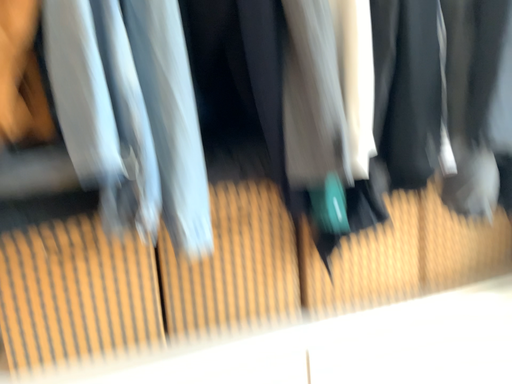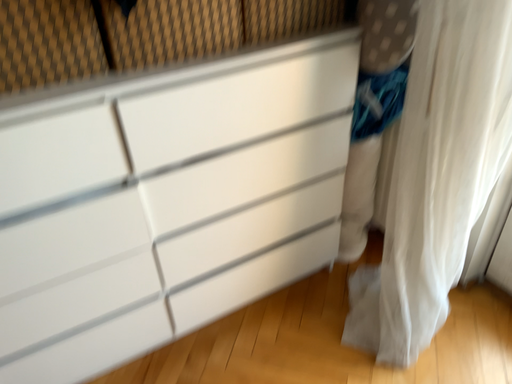
Question: How did the camera likely rotate when shooting the video?

Choices:
 (A) rotated left
 (B) rotated right

Answer: (B)